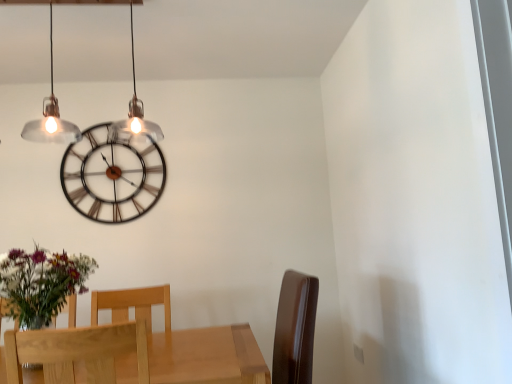
Question: From the image's perspective, is metallic wire clock at upper center on top of light wood chair at lower left, positioned as the 2th chair in front-to-back order?

Choices:
 (A) yes
 (B) no

Answer: (A)

Question: Would you say metallic wire clock at upper center is a long distance from light wood chair at lower left, positioned as the 2th chair in front-to-back order?

Choices:
 (A) no
 (B) yes

Answer: (A)

Question: From a real-world perspective, is metallic wire clock at upper center located higher than light wood chair at lower left, positioned as the 2th chair in front-to-back order?

Choices:
 (A) no
 (B) yes

Answer: (B)

Question: Is metallic wire clock at upper center next to light wood chair at lower left, positioned as the 2th chair in front-to-back order, and touching it?

Choices:
 (A) no
 (B) yes

Answer: (A)

Question: From a real-world perspective, does metallic wire clock at upper center sit lower than light wood chair at lower left, positioned as the 2th chair in front-to-back order?

Choices:
 (A) yes
 (B) no

Answer: (B)

Question: Can we say metallic wire clock at upper center lies outside light wood chair at lower left, positioned as the 2th chair in front-to-back order?

Choices:
 (A) no
 (B) yes

Answer: (B)

Question: Does light brown wood chair at lower left, the 2th chair in the back-to-front sequence, have a greater width compared to metallic wire clock at upper center?

Choices:
 (A) yes
 (B) no

Answer: (A)

Question: From the image's perspective, does light brown wood chair at lower left, the 2th chair in the back-to-front sequence, appear lower than metallic wire clock at upper center?

Choices:
 (A) yes
 (B) no

Answer: (A)

Question: Does light brown wood chair at lower left, the 2th chair in the back-to-front sequence, lie behind metallic wire clock at upper center?

Choices:
 (A) yes
 (B) no

Answer: (B)

Question: Is light brown wood chair at lower left, the 2th chair in the back-to-front sequence, facing towards metallic wire clock at upper center?

Choices:
 (A) no
 (B) yes

Answer: (A)

Question: Can you confirm if light brown wood chair at lower left, the 2th chair in the back-to-front sequence, is positioned to the right of metallic wire clock at upper center?

Choices:
 (A) yes
 (B) no

Answer: (A)

Question: From a real-world perspective, is light brown wood chair at lower left, acting as the first chair starting from the front, below metallic wire clock at upper center?

Choices:
 (A) yes
 (B) no

Answer: (A)

Question: From the image's perspective, is light wood chair at lower left, positioned as the 2th chair in front-to-back order, beneath metallic wire clock at upper center?

Choices:
 (A) no
 (B) yes

Answer: (B)